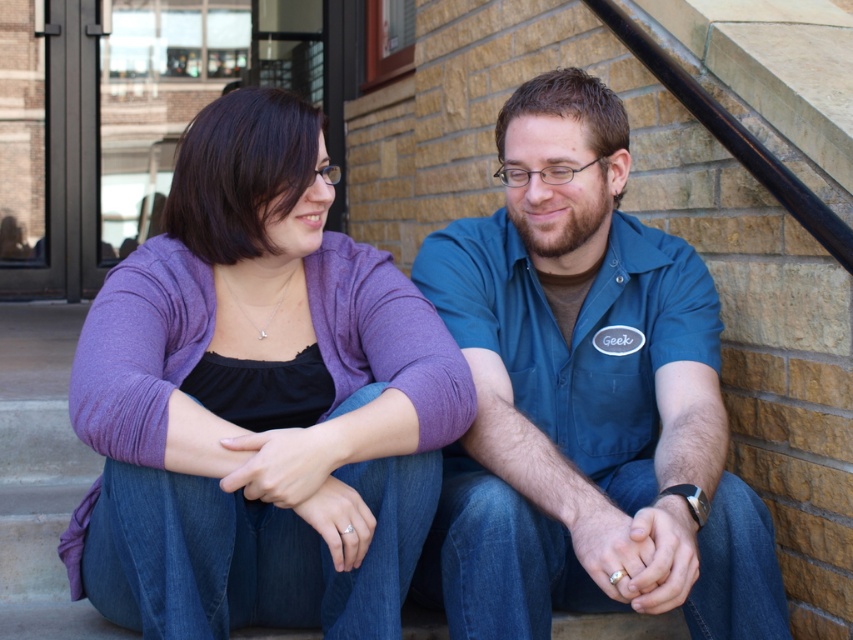
You are a photographer trying to capture a closeup of the purple soft sweater at center without the blue cotton shirt at center blocking the view. Based on their positions, is this possible?

The purple soft sweater at center is in front of the blue cotton shirt at center, so it is possible to capture a closeup of the purple soft sweater at center without the blue cotton shirt at center blocking the view.

You are designing a small gift box that must fit either the purple soft sweater at center or the blue cotton shirt at center. Based on the image, which item should you choose to ensure it fits inside the box?

The purple soft sweater at center occupies less space than the blue cotton shirt at center, so it should be chosen to ensure it fits inside the box.

You are standing 6 feet away from the stone steps where the two people are sitting. You want to toss a small object to the purple soft sweater at center without hitting anyone. Is it possible?

The purple soft sweater at center is 5.67 feet away from the viewer. Since you are standing 6 feet away, the distance is slightly farther than the sweater. However, since the sweater is part of the person on the left, tossing an object might risk hitting them. Therefore, it is not advisable to toss the object towards the sweater.